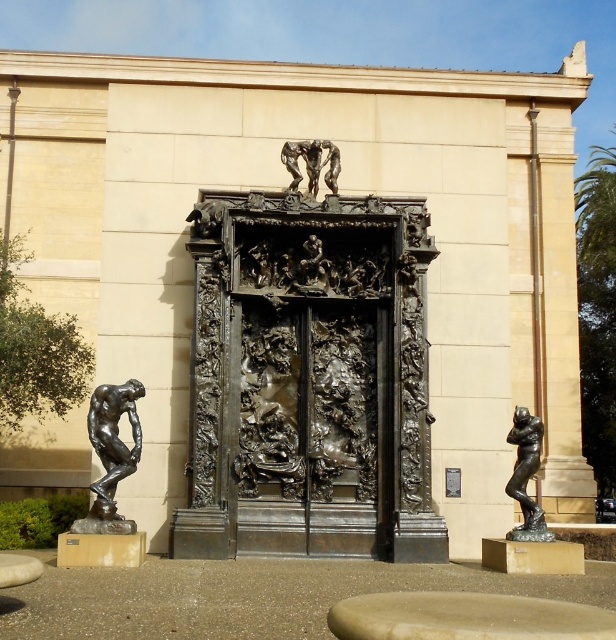
Question: Among these points, which one is nearest to the camera?

Choices:
 (A) (309, 195)
 (B) (532, 532)
 (C) (115, 483)

Answer: (C)

Question: Is matte black thinker at left smaller than bronze/metallic figure at upper center?

Choices:
 (A) yes
 (B) no

Answer: (B)

Question: Among these objects, which one is farthest from the camera?

Choices:
 (A) bronze/metallic figure at upper center
 (B) matte black thinker at left

Answer: (A)

Question: Does matte black thinker at left lie behind bronze textured figure at right?

Choices:
 (A) yes
 (B) no

Answer: (B)

Question: Is bronze textured figure at right closer to camera compared to bronze/metallic figure at upper center?

Choices:
 (A) yes
 (B) no

Answer: (A)

Question: Among these objects, which one is farthest from the camera?

Choices:
 (A) bronze/metallic figure at upper center
 (B) matte black thinker at left

Answer: (A)